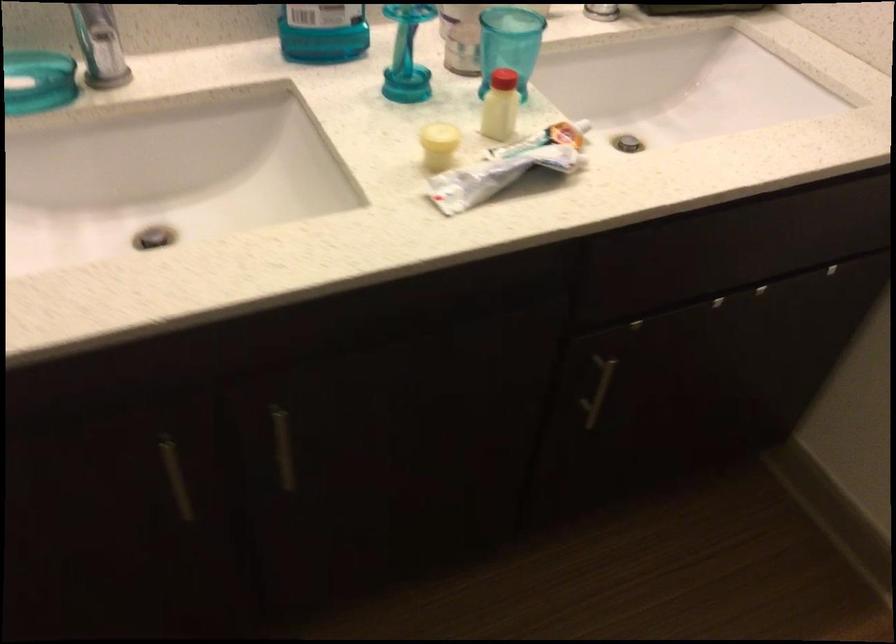
Where would you push the faucet lever? Please return your answer as a coordinate pair (x, y).

(99, 46)